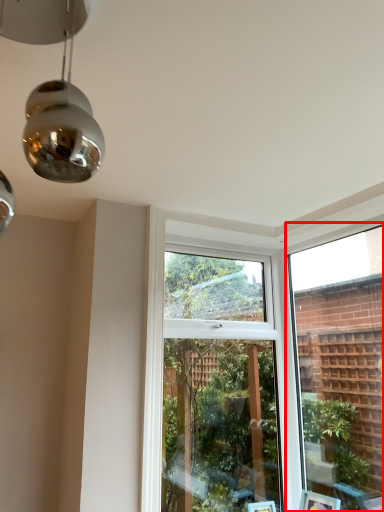
Question: From the image's perspective, what is the correct spatial positioning of window frame (annotated by the red box) in reference to window?

Choices:
 (A) below
 (B) above

Answer: (B)